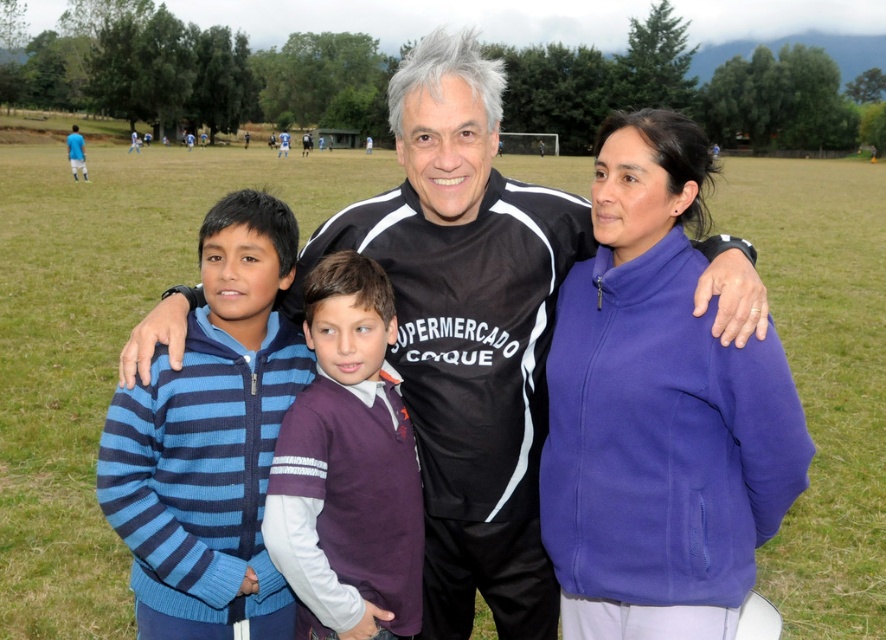
Question: Which point appears farthest from the camera in this image?

Choices:
 (A) (631, 628)
 (B) (332, 440)
 (C) (192, 332)
 (D) (443, 596)

Answer: (D)

Question: Is black matte shirt at center wider than purple fleece sweater at center?

Choices:
 (A) yes
 (B) no

Answer: (A)

Question: Which point is closer to the camera?

Choices:
 (A) purple fleece sweater at center
 (B) blue striped sweater at center
 (C) purple fleece jacket at right
 (D) black matte shirt at center

Answer: (D)

Question: Is black matte shirt at center positioned at the back of purple fleece sweater at center?

Choices:
 (A) yes
 (B) no

Answer: (B)

Question: Is blue striped sweater at center wider than purple fleece sweater at center?

Choices:
 (A) yes
 (B) no

Answer: (A)

Question: Which point appears farthest from the camera in this image?

Choices:
 (A) (745, 484)
 (B) (763, 314)

Answer: (A)